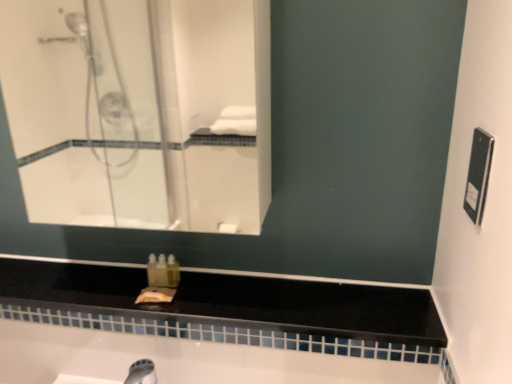
The image size is (512, 384). What are the coordinates of `vacant region above black matte counter top at center (from a real-world perspective)` in the screenshot? It's located at (183, 292).